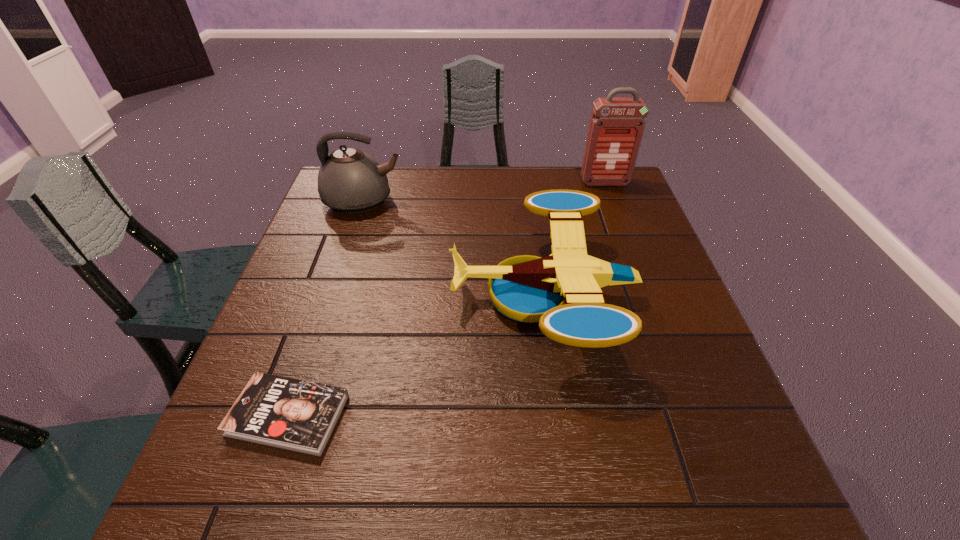
Locate an element on the screen. The image size is (960, 540). the tallest object is located at coordinates (616, 128).

Locate an element on the screen. the second tallest object is located at coordinates (350, 181).

This screenshot has height=540, width=960. What are the coordinates of `the second shortest object` in the screenshot? It's located at (562, 292).

Where is `book`? Image resolution: width=960 pixels, height=540 pixels. book is located at coordinates (292, 414).

The image size is (960, 540). Find the location of `vacant space located on the front-facing side of the tallest object`. vacant space located on the front-facing side of the tallest object is located at coordinates [x=624, y=234].

The image size is (960, 540). I want to click on free space located 0.240m at the spout of the second tallest object, so click(487, 201).

This screenshot has width=960, height=540. Identify the location of blank space located 0.210m at the cockpit of the drone. (361, 295).

Locate an element on the screen. Image resolution: width=960 pixels, height=540 pixels. free space located at the cockpit of the drone is located at coordinates (335, 295).

Find the location of a particular element. Image resolution: width=960 pixels, height=540 pixels. vacant space situated 0.120m at the cockpit of the drone is located at coordinates (399, 295).

Locate an element on the screen. free space located 0.080m on the front of the shortest object is located at coordinates (257, 507).